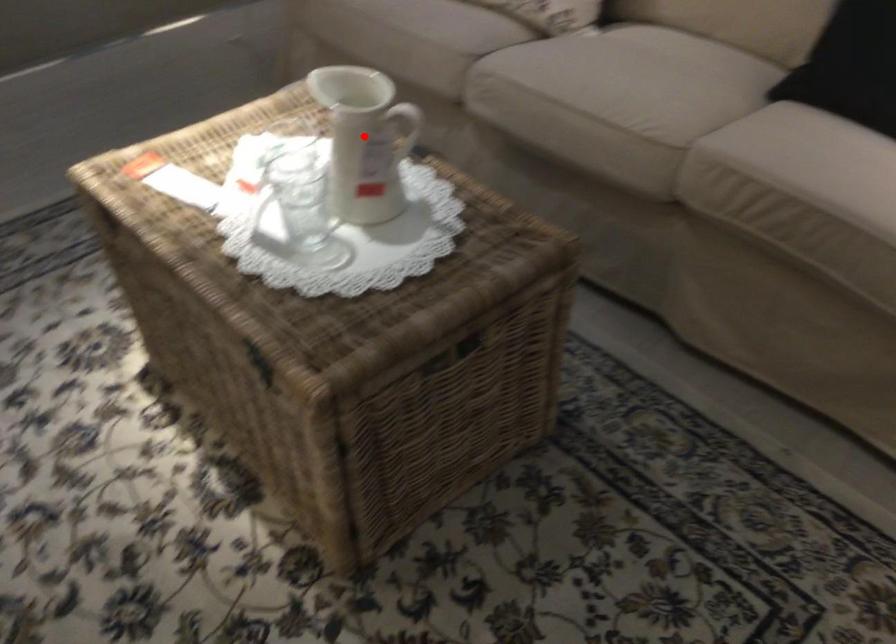
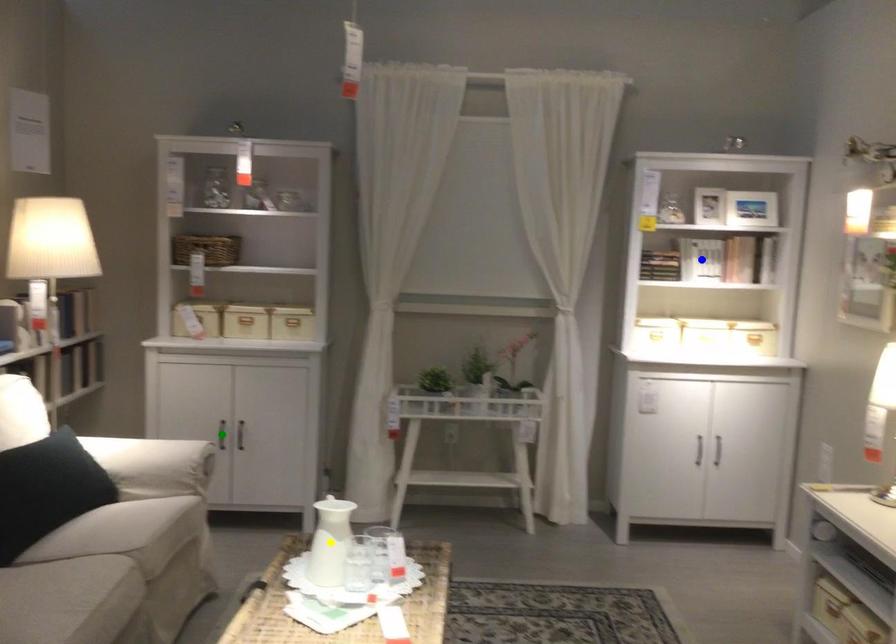
Question: I am providing you with two images of the same scene from different viewpoints. A red point is marked on the first image. You are given multiple points on the second image. Which point in image 2 represents the same 3d spot as the red point in image 1?

Choices:
 (A) yellow point
 (B) blue point
 (C) green point

Answer: (A)